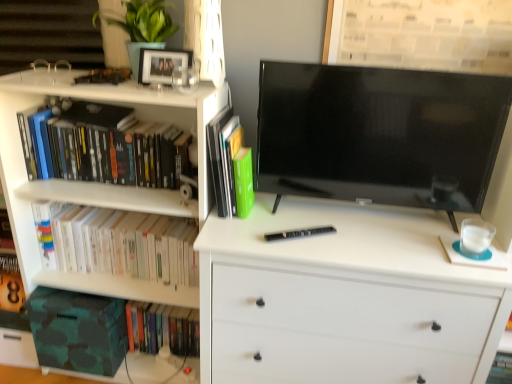
Image resolution: width=512 pixels, height=384 pixels. I want to click on unoccupied area in front of green matte book at center, which is counted as the 2th book, starting from the top, so click(242, 236).